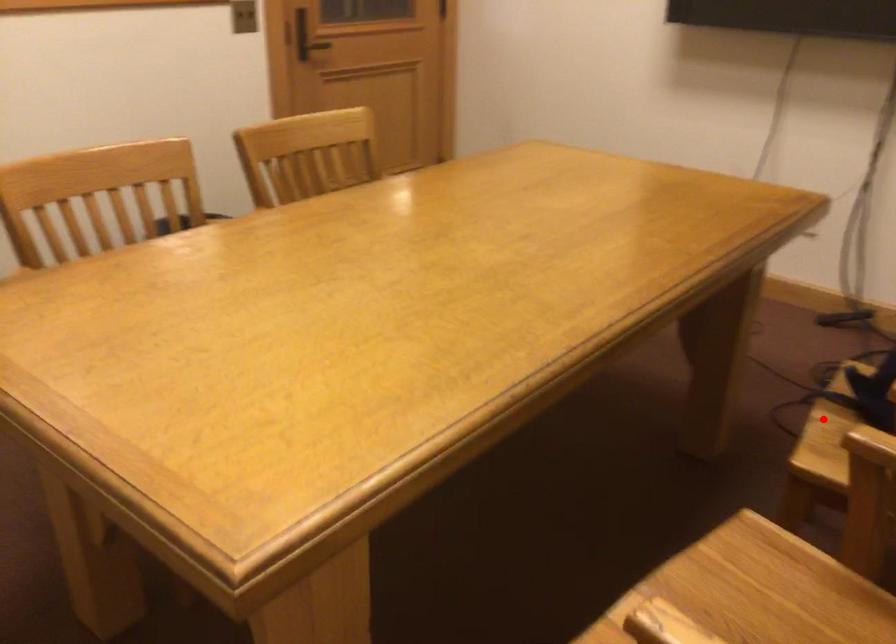
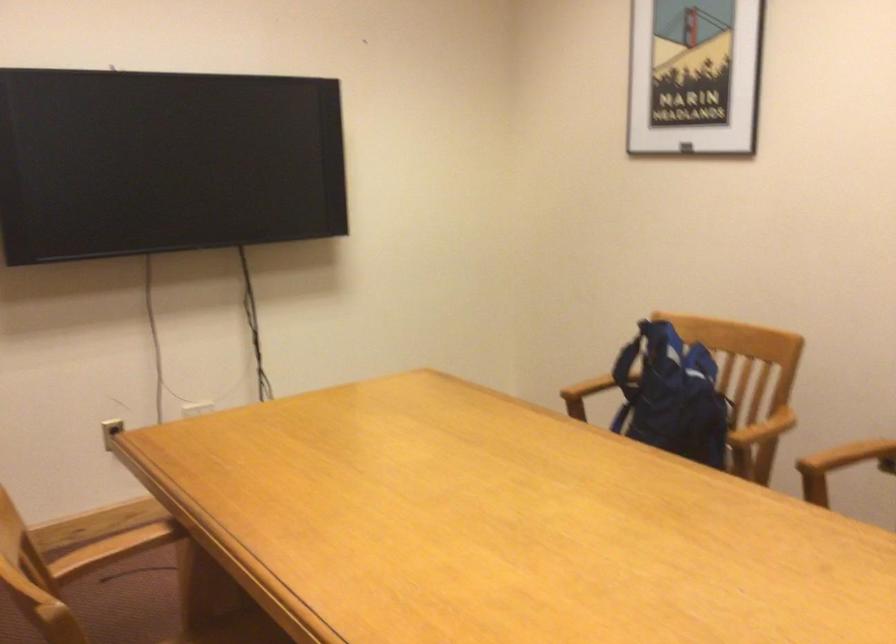
Question: I am providing you with two images of the same scene from different viewpoints. A red point is marked on the first image. Is the red point's position out of view in image 2?

Choices:
 (A) Yes
 (B) No

Answer: (A)